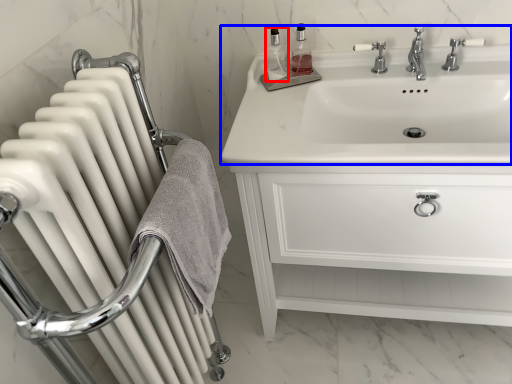
Question: Which object is closer to the camera taking this photo, toiletry (highlighted by a red box) or sink (highlighted by a blue box)?

Choices:
 (A) toiletry
 (B) sink

Answer: (B)